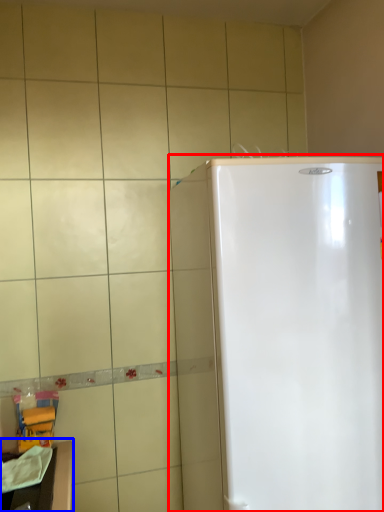
Question: Which object is further to the camera taking this photo, refrigerator (highlighted by a red box) or counter top (highlighted by a blue box)?

Choices:
 (A) refrigerator
 (B) counter top

Answer: (B)